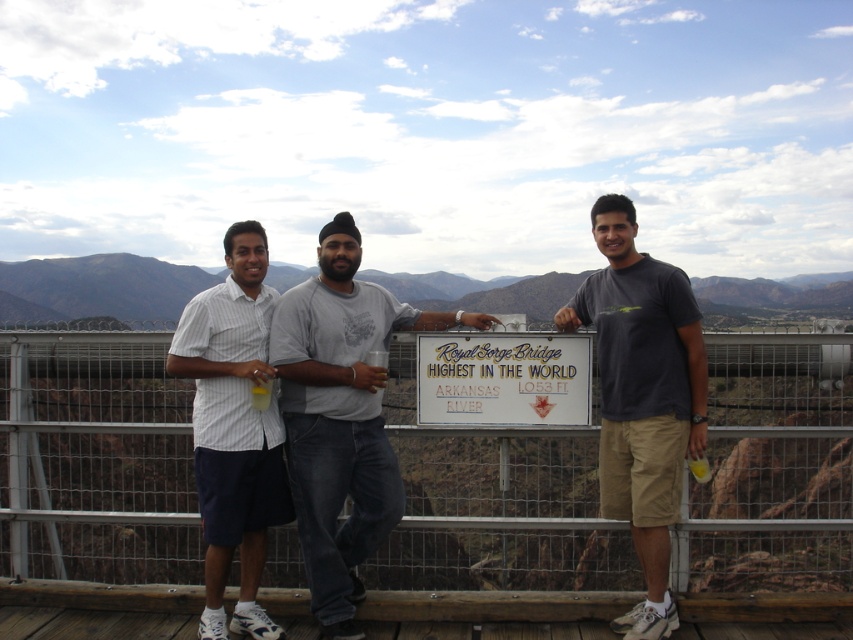
Is white striped shirt at left positioned before brown rocky mountain at center?

Yes, it is in front of brown rocky mountain at center.

Which is above, white striped shirt at left or brown rocky mountain at center?

brown rocky mountain at center is higher up.

The width and height of the screenshot is (853, 640). What are the coordinates of `white striped shirt at left` in the screenshot? It's located at (234, 428).

Where is `white striped shirt at left`? Image resolution: width=853 pixels, height=640 pixels. white striped shirt at left is located at coordinates (234, 428).

Is metal fence at center smaller than gray cotton t-shirt at center?

No.

At what (x,y) coordinates should I click in order to perform the action: click on metal fence at center. Please return your answer as a coordinate pair (x, y). Looking at the image, I should click on (94, 460).

Which of these two, metal fence at center or brown rocky mountain at center, stands shorter?

metal fence at center

Locate an element on the screen. metal fence at center is located at coordinates (94, 460).

Locate an element on the screen. This screenshot has width=853, height=640. metal fence at center is located at coordinates (94, 460).